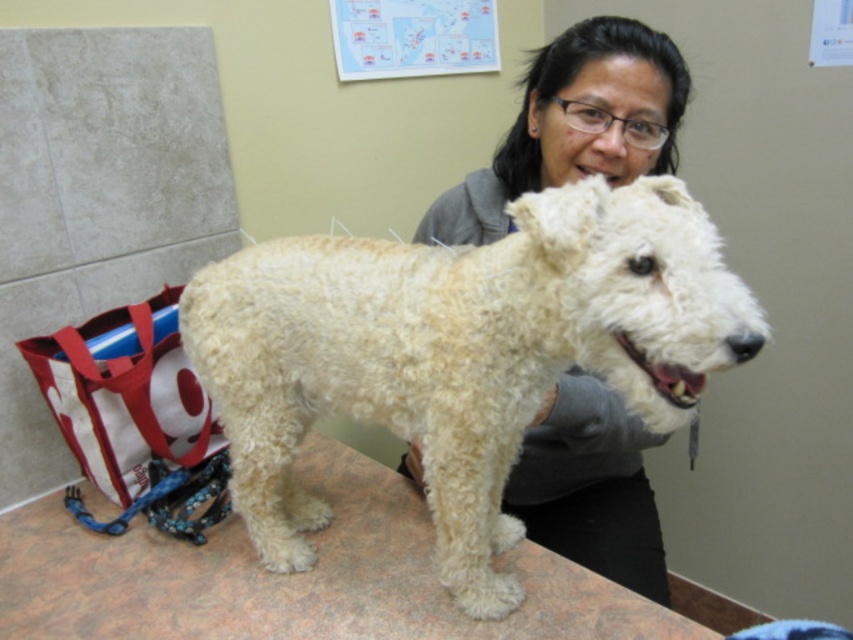
Between smooth brown table at center and smooth gray hoodie at center, which one has more height?

smooth gray hoodie at center is taller.

Can you confirm if smooth brown table at center is positioned to the left of smooth gray hoodie at center?

Indeed, smooth brown table at center is positioned on the left side of smooth gray hoodie at center.

Does point (412, 602) come closer to viewer compared to point (556, 509)?

Yes, it is.

What are the coordinates of `smooth brown table at center` in the screenshot? It's located at (x=294, y=577).

Is point (660, 177) farther from camera compared to point (183, 547)?

No, it is not.

Can you confirm if white fluffy dog at center is positioned to the right of smooth brown table at center?

Yes, white fluffy dog at center is to the right of smooth brown table at center.

Identify the location of white fluffy dog at center. This screenshot has width=853, height=640. click(460, 353).

Which of these two, white fluffy dog at center or smooth gray hoodie at center, stands taller?

white fluffy dog at center

Measure the distance between white fluffy dog at center and smooth gray hoodie at center.

The distance of white fluffy dog at center from smooth gray hoodie at center is 8.85 inches.

Is point (683, 273) closer to camera compared to point (463, 230)?

Yes, point (683, 273) is closer to viewer.

The image size is (853, 640). I want to click on white fluffy dog at center, so click(x=460, y=353).